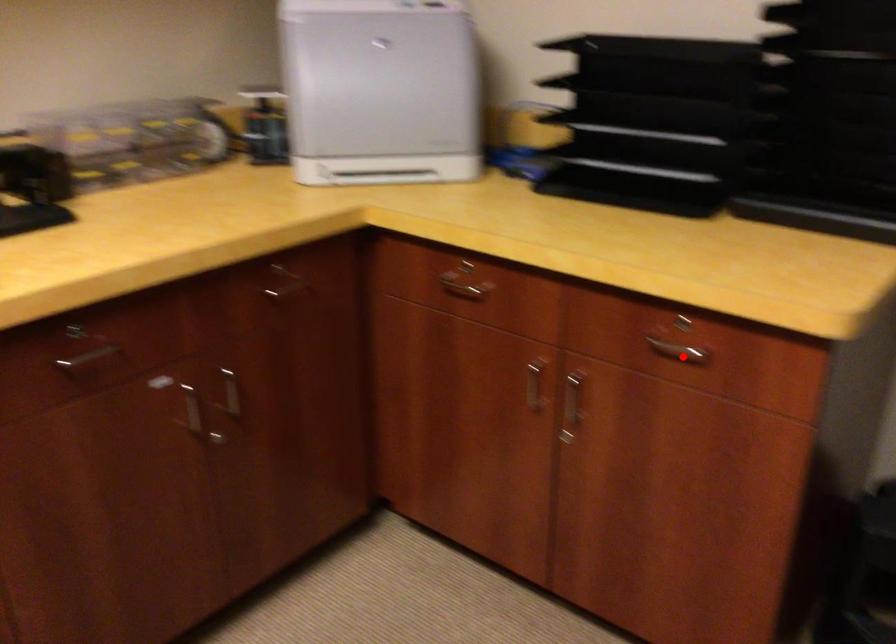
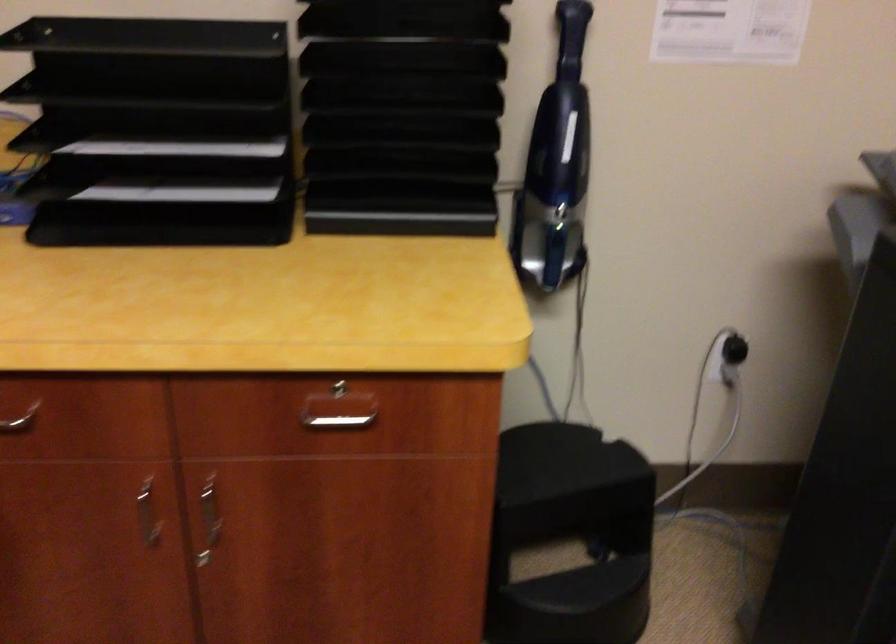
Question: I am providing you with two images of the same scene from different viewpoints. Given a red point in image1, look at the same physical point in image2. Is it:

Choices:
 (A) Closer to the viewpoint
 (B) Farther from the viewpoint

Answer: (A)